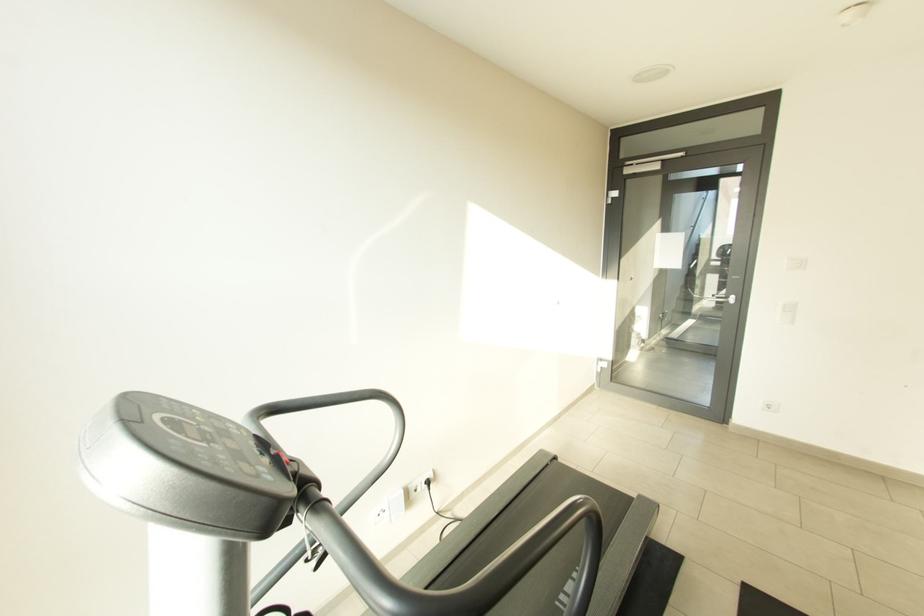
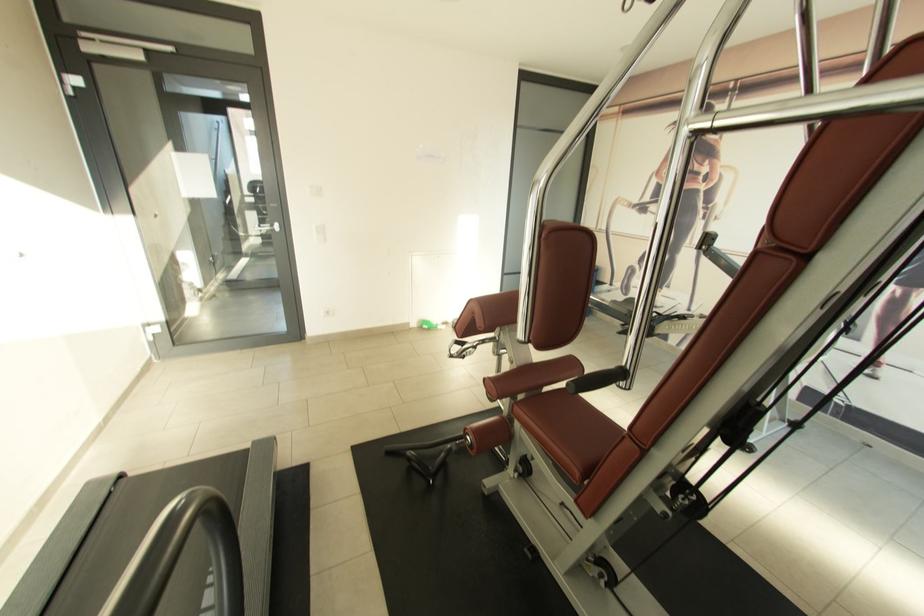
Question: The camera is either moving clockwise (left) or counter-clockwise (right) around the object. The first image is from the beginning of the video and the second image is from the end. Is the camera moving left or right when shooting the video?

Choices:
 (A) Left
 (B) Right

Answer: (A)